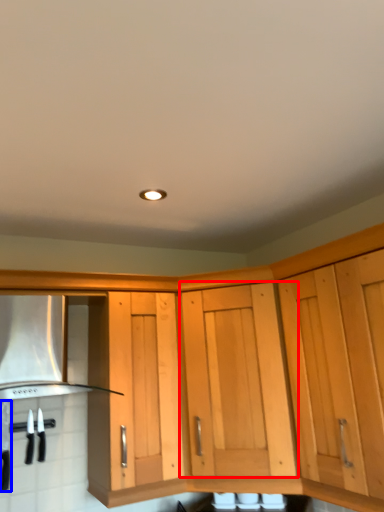
Question: Which of the following is the closest to the observer, cabinetry (highlighted by a red box) or kitchen appliance (highlighted by a blue box)?

Choices:
 (A) cabinetry
 (B) kitchen appliance

Answer: (A)